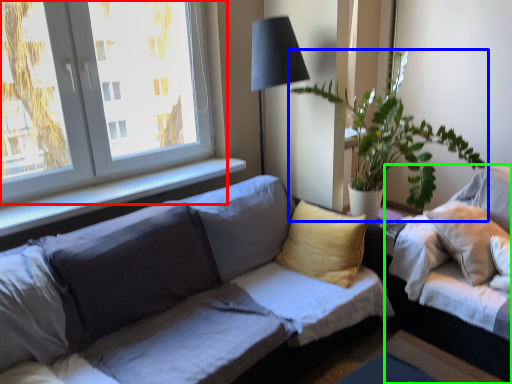
Question: Which is farther away from window (highlighted by a red box)? houseplant (highlighted by a blue box) or studio couch (highlighted by a green box)?

Choices:
 (A) houseplant
 (B) studio couch

Answer: (B)